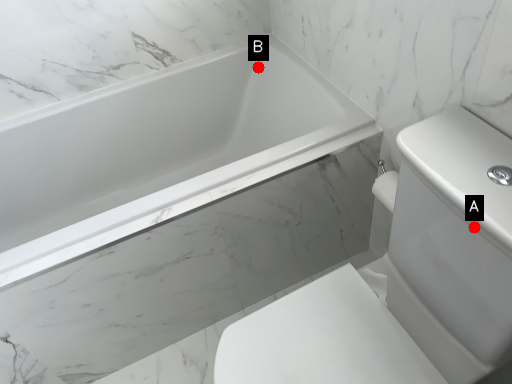
Question: Two points are circled on the image, labeled by A and B beside each circle. Which point is closer to the camera?

Choices:
 (A) A is closer
 (B) B is closer

Answer: (A)